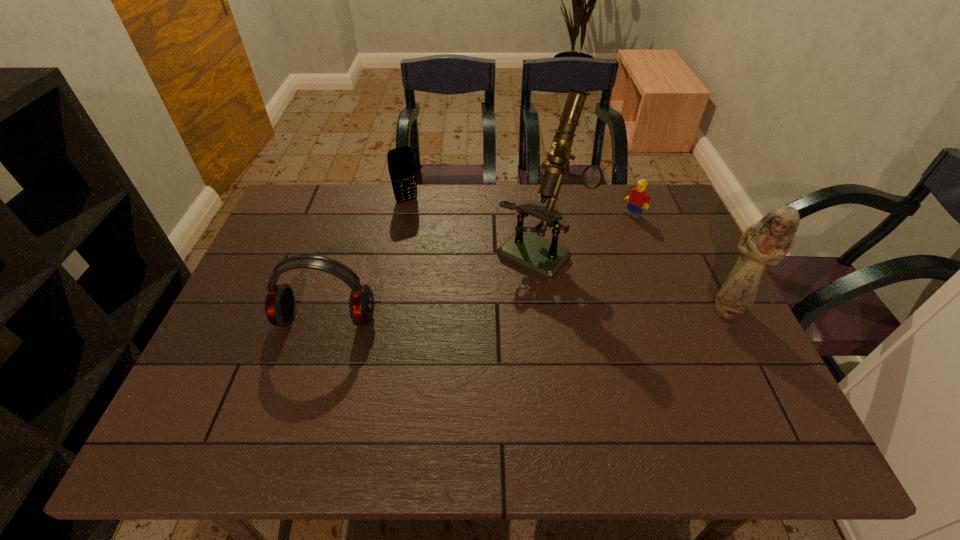
Identify the location of free spot on the desktop that is between the earphone and the fourth shortest object and is positioned on the screen of the cellular telephone. Image resolution: width=960 pixels, height=540 pixels. (473, 315).

Find the location of `vacant spot on the desktop that is between the earphone and the figurine and is positioned on the front-facing side of the Lego`. vacant spot on the desktop that is between the earphone and the figurine and is positioned on the front-facing side of the Lego is located at coordinates (518, 314).

The image size is (960, 540). I want to click on vacant space on the desktop that is between the earphone and the fourth shortest object and is positioned at the eyepiece of the third object from right to left, so click(479, 315).